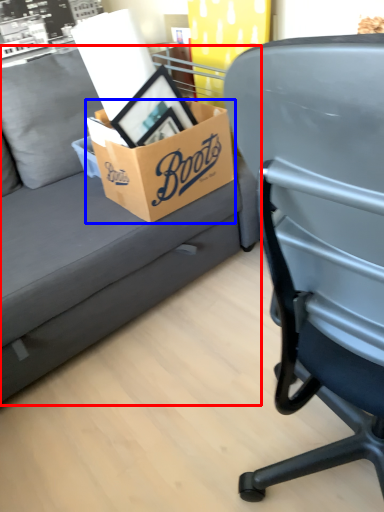
Question: Which object appears closest to the camera in this image, studio couch (highlighted by a red box) or box (highlighted by a blue box)?

Choices:
 (A) studio couch
 (B) box

Answer: (A)